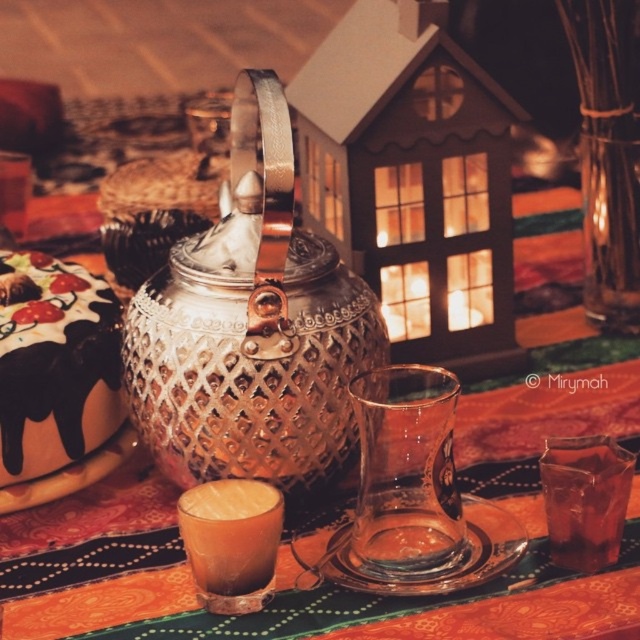
Can you confirm if polished copper teapot at center is positioned above transparent glass at center?

Yes.

Which is behind, point (262, 333) or point (360, 438)?

The point (262, 333) is behind.

Identify the location of polished copper teapot at center. (250, 326).

Image resolution: width=640 pixels, height=640 pixels. Find the location of `polished copper teapot at center`. polished copper teapot at center is located at coordinates (250, 326).

Find the location of a particular element. polished copper teapot at center is located at coordinates (250, 326).

From the picture: Can you confirm if polished copper teapot at center is positioned below translucent glass at lower right?

No.

Describe the element at coordinates (250, 326) in the screenshot. I see `polished copper teapot at center` at that location.

Where is `polished copper teapot at center`? This screenshot has width=640, height=640. polished copper teapot at center is located at coordinates (250, 326).

Can you confirm if transparent glass at center is positioned above translucent glass at lower right?

Indeed, transparent glass at center is positioned over translucent glass at lower right.

Which is below, transparent glass at center or translucent glass at lower right?

translucent glass at lower right is lower down.

Between point (428, 413) and point (554, 502), which one is positioned behind?

Point (554, 502)

Locate an element on the screen. The width and height of the screenshot is (640, 640). transparent glass at center is located at coordinates (406, 472).